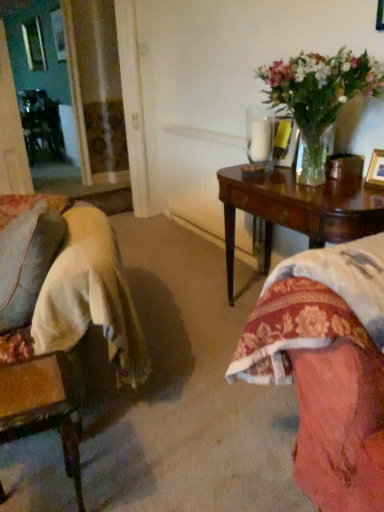
Question: Is clear glass vase at upper right shorter than mahogany wood table at right?

Choices:
 (A) no
 (B) yes

Answer: (B)

Question: Is clear glass vase at upper right turned away from mahogany wood table at right?

Choices:
 (A) no
 (B) yes

Answer: (A)

Question: Is clear glass vase at upper right taller than mahogany wood table at right?

Choices:
 (A) no
 (B) yes

Answer: (A)

Question: Is clear glass vase at upper right to the left of mahogany wood table at right from the viewer's perspective?

Choices:
 (A) yes
 (B) no

Answer: (B)

Question: Can you confirm if clear glass vase at upper right is smaller than mahogany wood table at right?

Choices:
 (A) no
 (B) yes

Answer: (B)

Question: From a real-world perspective, is clear glass vase at upper right on top of mahogany wood table at right?

Choices:
 (A) no
 (B) yes

Answer: (B)

Question: Is mahogany wood table at right in contact with wooden swivel chair at lower left?

Choices:
 (A) no
 (B) yes

Answer: (A)

Question: From a real-world perspective, is mahogany wood table at right physically above wooden swivel chair at lower left?

Choices:
 (A) yes
 (B) no

Answer: (A)

Question: Is mahogany wood table at right aimed at wooden swivel chair at lower left?

Choices:
 (A) yes
 (B) no

Answer: (A)

Question: From the image's perspective, is mahogany wood table at right beneath wooden swivel chair at lower left?

Choices:
 (A) no
 (B) yes

Answer: (A)

Question: From a real-world perspective, is mahogany wood table at right below wooden swivel chair at lower left?

Choices:
 (A) no
 (B) yes

Answer: (A)

Question: Is the position of mahogany wood table at right more distant than that of wooden swivel chair at lower left?

Choices:
 (A) yes
 (B) no

Answer: (A)

Question: Considering the relative positions of clear glass vase at upper right and white textured radiator at center in the image provided, is clear glass vase at upper right to the left of white textured radiator at center from the viewer's perspective?

Choices:
 (A) yes
 (B) no

Answer: (B)